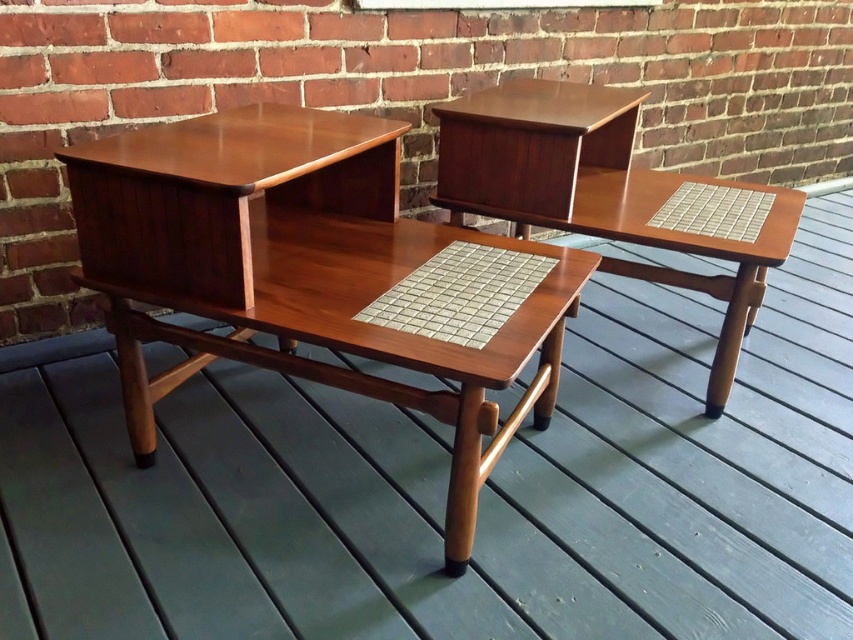
Who is shorter, wooden/matte desk at center or wooden tile desk at center?

wooden/matte desk at center

Locate an element on the screen. The width and height of the screenshot is (853, 640). wooden/matte desk at center is located at coordinates [x=317, y=275].